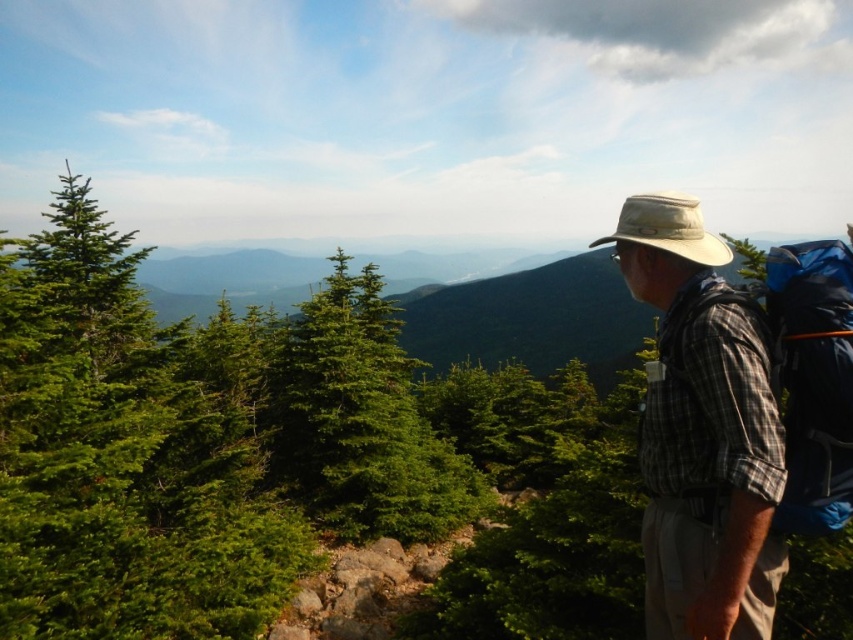
Does green matte tree at left appear over tan canvas hat at upper right?

No.

Is the position of green matte tree at left less distant than that of tan canvas hat at upper right?

That is False.

Image resolution: width=853 pixels, height=640 pixels. Describe the element at coordinates (122, 456) in the screenshot. I see `green matte tree at left` at that location.

Identify the location of green matte tree at left. (122, 456).

Which is below, plaid fabric shirt at right or blue fabric backpack at right?

blue fabric backpack at right is lower down.

Is plaid fabric shirt at right shorter than blue fabric backpack at right?

No.

The width and height of the screenshot is (853, 640). What are the coordinates of `plaid fabric shirt at right` in the screenshot? It's located at (701, 433).

Locate an element on the screen. plaid fabric shirt at right is located at coordinates tap(701, 433).

Is green matte tree at left to the right of blue fabric backpack at right from the viewer's perspective?

In fact, green matte tree at left is to the left of blue fabric backpack at right.

From the picture: Between green matte tree at left and blue fabric backpack at right, which one appears on the right side from the viewer's perspective?

blue fabric backpack at right

Is point (0, 433) closer to viewer compared to point (843, 426)?

That is False.

Where is `green matte tree at left`? green matte tree at left is located at coordinates (122, 456).